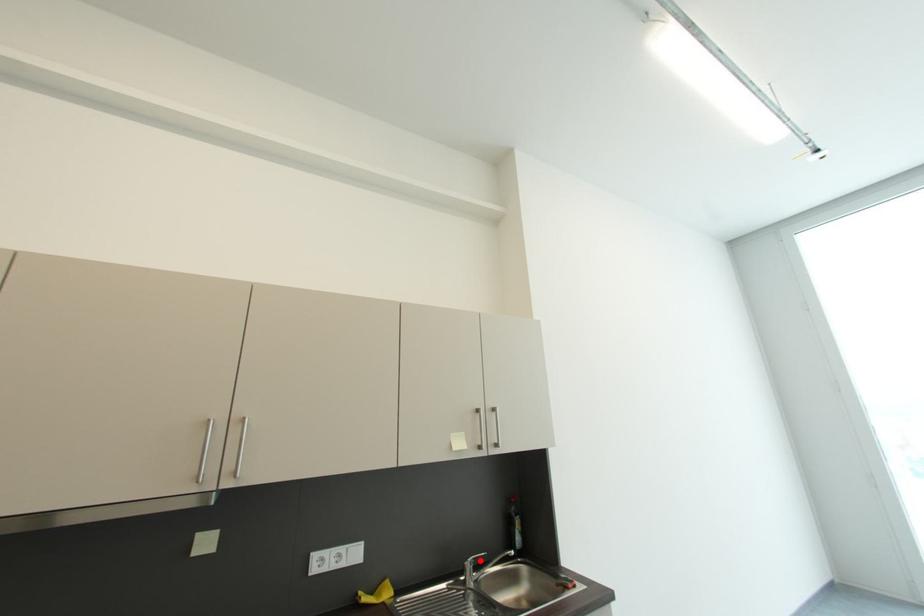
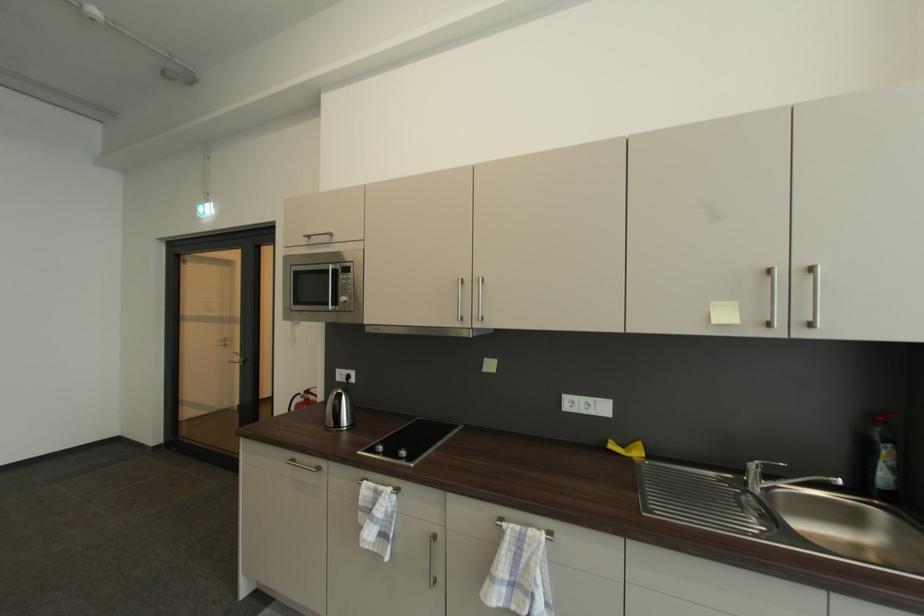
The point at the highlighted location is marked in the first image. Where is the corresponding point in the second image?

(769, 466)